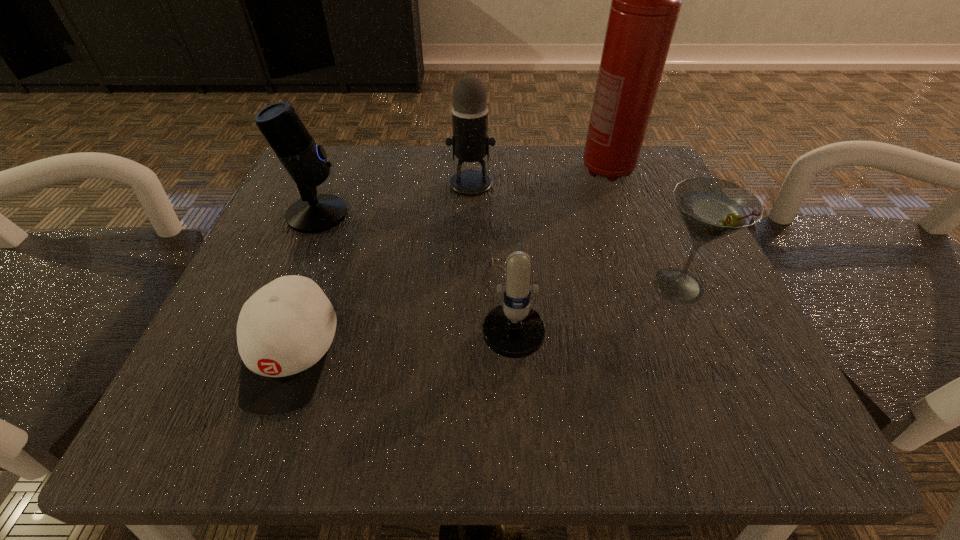
This screenshot has height=540, width=960. Find the location of `the tallest object`. the tallest object is located at coordinates (646, 0).

Locate an element on the screen. the farthest microphone is located at coordinates (470, 142).

In order to click on the third farthest object in this screenshot , I will do `click(305, 161)`.

This screenshot has width=960, height=540. Identify the location of the leftmost microphone. (305, 161).

I want to click on martini, so click(711, 208).

Locate an element on the screen. The width and height of the screenshot is (960, 540). the second shortest object is located at coordinates (514, 330).

Find the location of a particular element. The image size is (960, 540). the nearest microphone is located at coordinates (514, 330).

At what (x,y) coordinates should I click in order to perform the action: click on the shortest object. Please return your answer as a coordinate pair (x, y). This screenshot has width=960, height=540. Looking at the image, I should click on (284, 331).

Where is `free location located on the handle side the fire extinguisher`? This screenshot has width=960, height=540. free location located on the handle side the fire extinguisher is located at coordinates (666, 333).

I want to click on free space located 0.170m on the right of the farthest microphone, so click(581, 184).